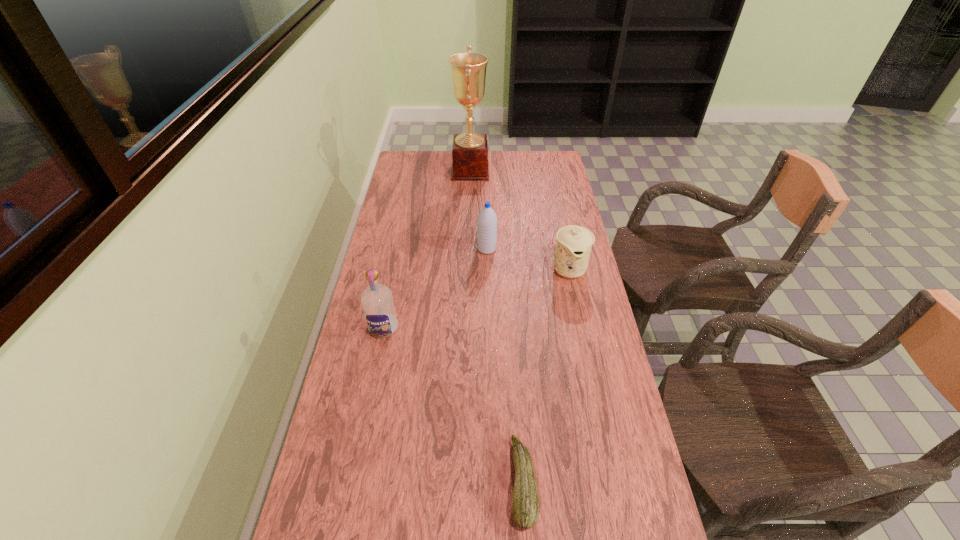
Locate an element on the screen. Image resolution: width=960 pixels, height=540 pixels. free space located on the back of the water bottle is located at coordinates (487, 217).

Locate an element on the screen. free region located 0.120m on the spout of the rightmost object is located at coordinates (579, 314).

This screenshot has height=540, width=960. What are the coordinates of `vacant space located at the stem end of the shortest object` in the screenshot? It's located at (427, 482).

This screenshot has height=540, width=960. Identify the location of free space located at the stem end of the shortest object. (479, 482).

You are a GUI agent. You are given a task and a screenshot of the screen. Output one action in this format:
    pyautogui.click(x=<x>, y=<y>)
    Task: Click on the free space located at the stem end of the shortest object
    
    Given the screenshot: What is the action you would take?
    pyautogui.click(x=440, y=482)

Where is `object that is at the far edge`? object that is at the far edge is located at coordinates (470, 150).

This screenshot has height=540, width=960. I want to click on object that is at the left edge, so click(x=377, y=301).

This screenshot has width=960, height=540. I want to click on object that is at the right edge, so (x=574, y=243).

Image resolution: width=960 pixels, height=540 pixels. What are the coordinates of `vacant area at the left edge of the desktop` in the screenshot? It's located at (376, 255).

You are a GUI agent. You are given a task and a screenshot of the screen. Output one action in this format:
    pyautogui.click(x=<x>, y=<y>)
    Task: Click on the free point at the right edge
    The width and height of the screenshot is (960, 540).
    Given the screenshot: What is the action you would take?
    pyautogui.click(x=597, y=364)